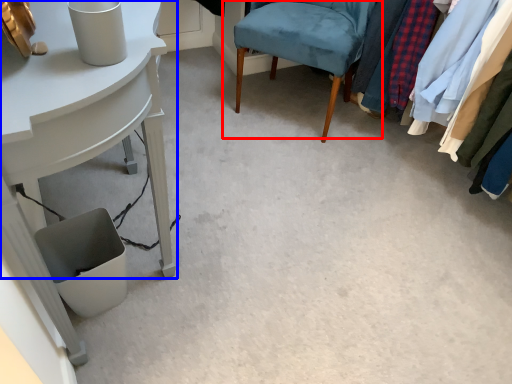
Question: Which of the following is the farthest to the observer, chair (highlighted by a red box) or table (highlighted by a blue box)?

Choices:
 (A) chair
 (B) table

Answer: (A)